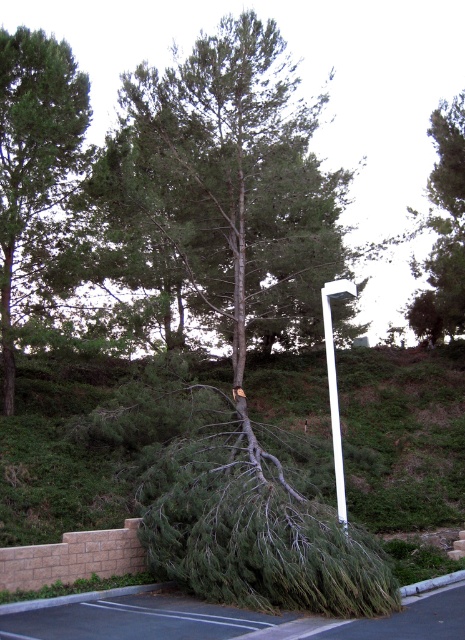
You are a delivery driver who needs to park your 5.5 meter long truck in the parking lot shown in the image. The truck requires a space of at least 5.5 meters to park safely. You see the white glossy street sign at center. Can you determine if there is enough space between the fallen tree and the retaining wall to park your truck?

The white glossy street sign at center is 9.60 meters from the camera. Since the truck requires 5.5 meters, and the distance from the camera to the sign is greater than the truck length, there is sufficient space between the fallen tree and the retaining wall to park the truck safely.

You are a city worker assessing the fallen pine tree scene. You need to determine if the white glossy street sign at center can be placed on the brushed metal curb at lower right. Based on their widths, will it fit?

The white glossy street sign at center has a greater width than the brushed metal curb at lower right, so it cannot fit on the curb.

You are a city planner assessing the safety of the parking lot. You notice the green rough bark tree at center and the green rough bark tree at upper right. Which tree has a wider trunk?

The green rough bark tree at center has a wider trunk than the green rough bark tree at upper right because its width surpasses the other.